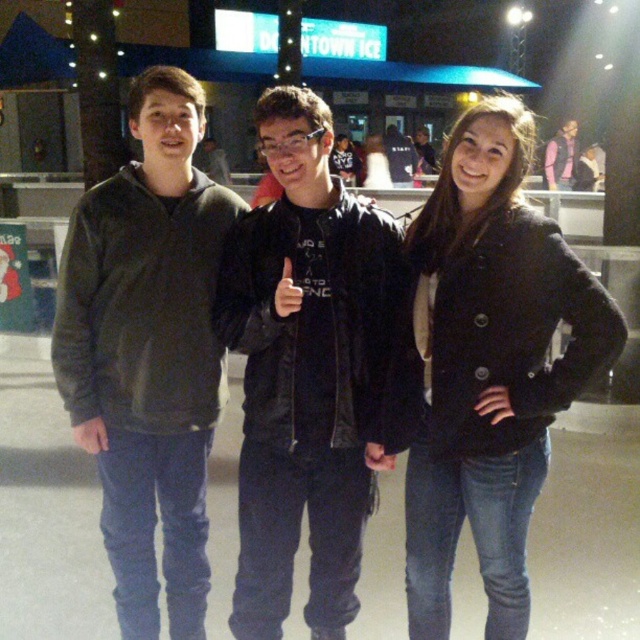
You are trying to locate the black fuzzy coat at center in the image. According to the coordinates provided, where exactly would you find it?

The black fuzzy coat at center is located at point coordinates of 0.573 on the x axis and 0.759 on the y axis.

You are taking a photo of the black fuzzy coat at center and the pink fabric shirt at center. Which one is positioned to the left in the image?

The black fuzzy coat at center is to the left of the pink fabric shirt at center.